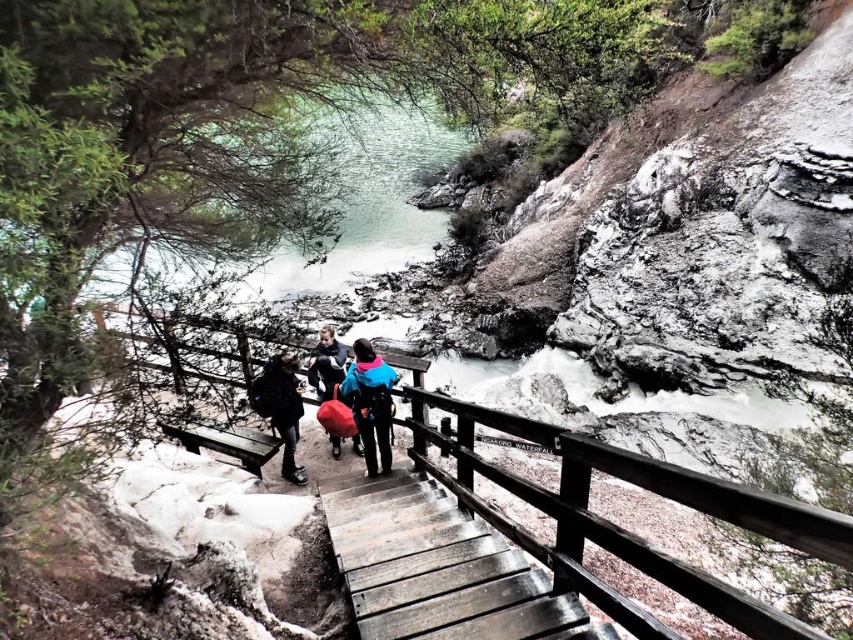
Is point (677, 577) positioned in front of point (297, 420)?

Yes, point (677, 577) is in front of point (297, 420).

Between wooden rail at center and dark gray fabric backpack at center, which one has more height?

dark gray fabric backpack at center

Which is in front, point (428, 397) or point (291, 396)?

Point (428, 397) is in front.

Locate an element on the screen. wooden rail at center is located at coordinates pyautogui.click(x=614, y=524).

Measure the distance between wooden stairs at center and matte black jacket at center.

wooden stairs at center and matte black jacket at center are 8.98 feet apart.

Is wooden stairs at center taller than matte black jacket at center?

In fact, wooden stairs at center may be shorter than matte black jacket at center.

Does point (379, 483) come behind point (335, 344)?

That is False.

Where is `wooden stairs at center`? wooden stairs at center is located at coordinates (438, 566).

Is blue fleece jacket at center above dark gray fabric backpack at center?

Indeed, blue fleece jacket at center is positioned over dark gray fabric backpack at center.

Is blue fleece jacket at center smaller than dark gray fabric backpack at center?

Actually, blue fleece jacket at center might be larger than dark gray fabric backpack at center.

Between point (376, 401) and point (294, 365), which one is positioned behind?

Positioned behind is point (294, 365).

Where is `blue fleece jacket at center`? The height and width of the screenshot is (640, 853). blue fleece jacket at center is located at coordinates (370, 403).